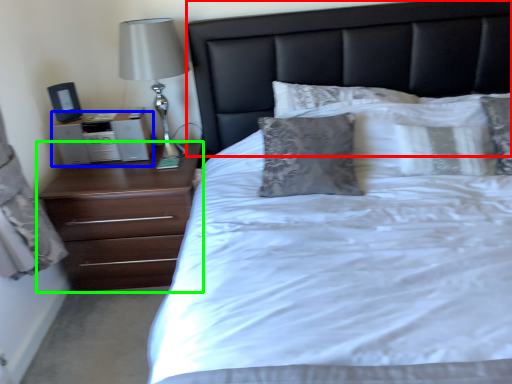
Question: Estimate the real-world distances between objects in this image. Which object is farther from headboard (highlighted by a red box), nightstand (highlighted by a blue box) or chest of drawers (highlighted by a green box)?

Choices:
 (A) nightstand
 (B) chest of drawers

Answer: (A)